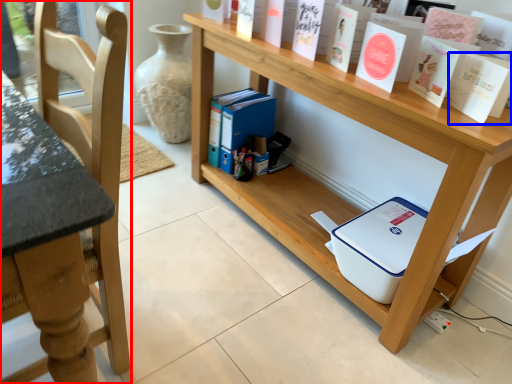
Question: Which point is closer to the camera, chair (highlighted by a red box) or paperback book (highlighted by a blue box)?

Choices:
 (A) chair
 (B) paperback book

Answer: (A)